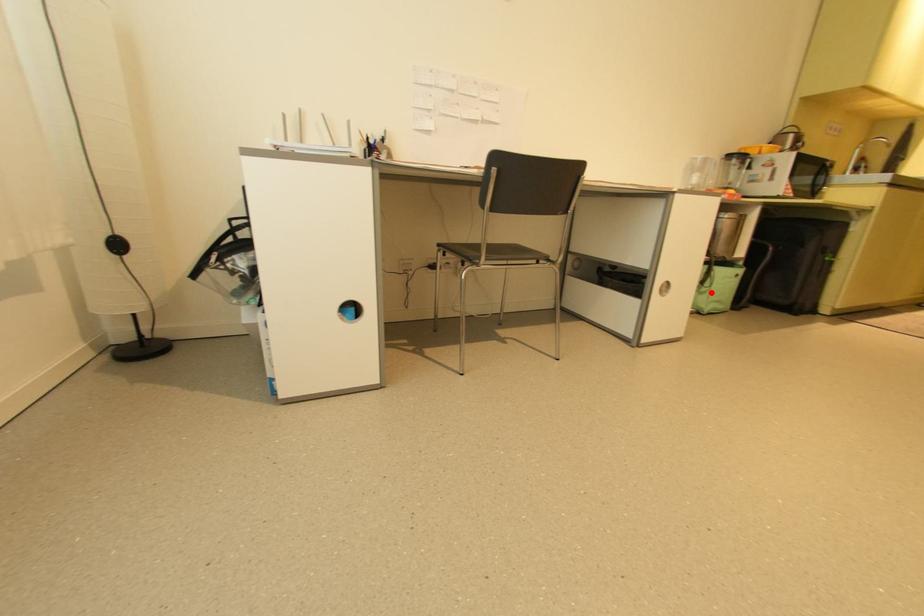
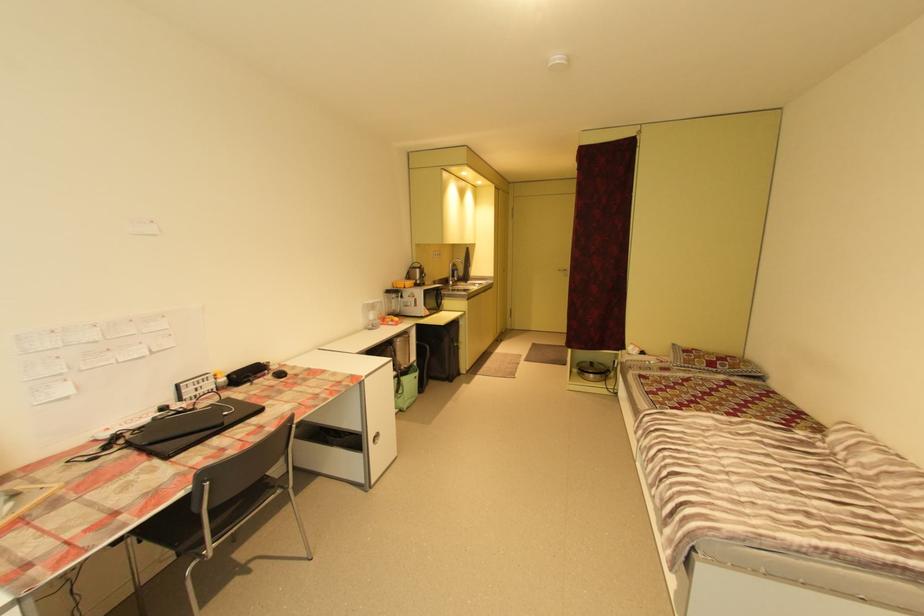
Question: I am providing you with two images of the same scene from different viewpoints. Given a red point in image1, look at the same physical point in image2. Is it:

Choices:
 (A) Closer to the viewpoint
 (B) Farther from the viewpoint

Answer: (B)